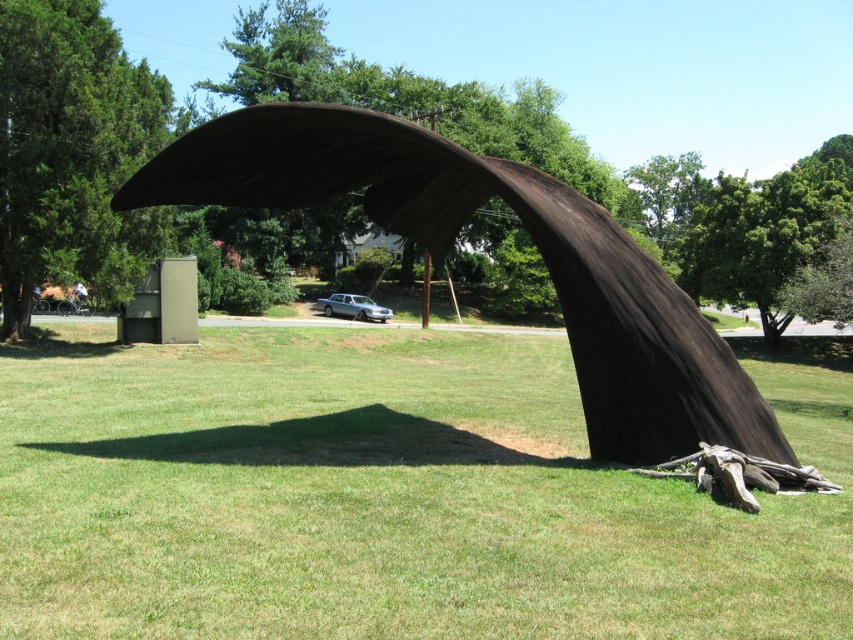
You are standing in the grassy area and want to take a photo of both the black wood sculpture at center and the green leafy tree at left. Based on their positions, which object should you position on your left side to include both in the frame?

You should position the green leafy tree at left on your left side because the black wood sculpture at center is to the right of the green leafy tree at left.